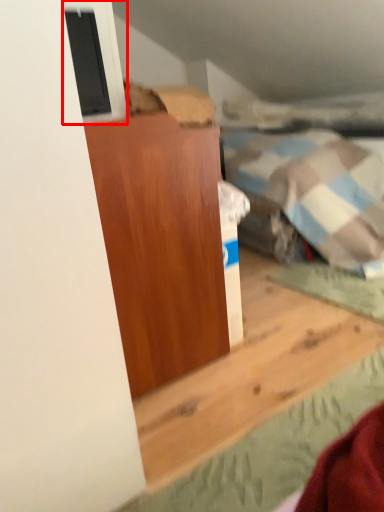
Question: Where is window (annotated by the red box) located in relation to furniture in the image?

Choices:
 (A) left
 (B) right

Answer: (A)